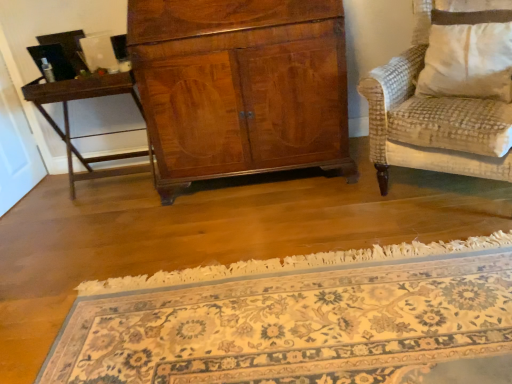
Question: Is floral carpet at center bigger than dark brown wood table at left?

Choices:
 (A) yes
 (B) no

Answer: (A)

Question: Can you confirm if floral carpet at center is smaller than dark brown wood table at left?

Choices:
 (A) yes
 (B) no

Answer: (B)

Question: Is floral carpet at center oriented away from dark brown wood table at left?

Choices:
 (A) no
 (B) yes

Answer: (A)

Question: From the image's perspective, is floral carpet at center located above dark brown wood table at left?

Choices:
 (A) yes
 (B) no

Answer: (B)

Question: Could you tell me if floral carpet at center is turned towards dark brown wood table at left?

Choices:
 (A) yes
 (B) no

Answer: (B)

Question: Is white textured pillow at right in front of or behind dark brown wood table at left in the image?

Choices:
 (A) front
 (B) behind

Answer: (A)

Question: Based on their sizes in the image, would you say white textured pillow at right is bigger or smaller than dark brown wood table at left?

Choices:
 (A) big
 (B) small

Answer: (B)

Question: From a real-world perspective, is white textured pillow at right physically located above or below dark brown wood table at left?

Choices:
 (A) below
 (B) above

Answer: (B)

Question: Is white textured pillow at right to the left or to the right of dark brown wood table at left in the image?

Choices:
 (A) right
 (B) left

Answer: (A)

Question: From the image's perspective, is floral carpet at center positioned above or below dark brown wood table at left?

Choices:
 (A) below
 (B) above

Answer: (A)

Question: Is point (398, 319) positioned closer to the camera than point (118, 157)?

Choices:
 (A) closer
 (B) farther

Answer: (A)

Question: In terms of height, does floral carpet at center look taller or shorter compared to dark brown wood table at left?

Choices:
 (A) tall
 (B) short

Answer: (B)

Question: In the image, is floral carpet at center positioned in front of or behind dark brown wood table at left?

Choices:
 (A) behind
 (B) front

Answer: (B)

Question: Is dark brown wood table at left inside or outside of floral carpet at center?

Choices:
 (A) inside
 (B) outside

Answer: (B)

Question: Is point (104, 94) positioned closer to the camera than point (433, 286)?

Choices:
 (A) closer
 (B) farther

Answer: (B)